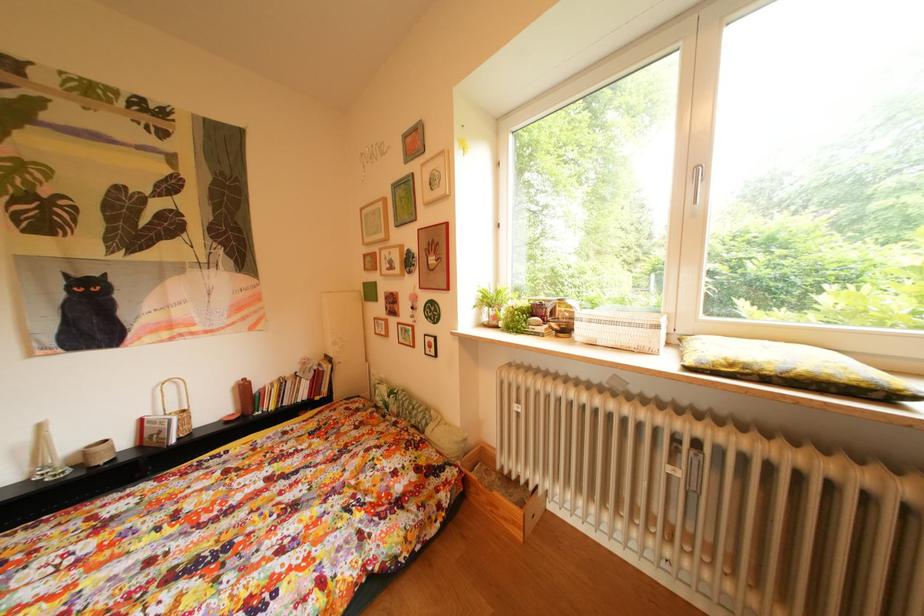
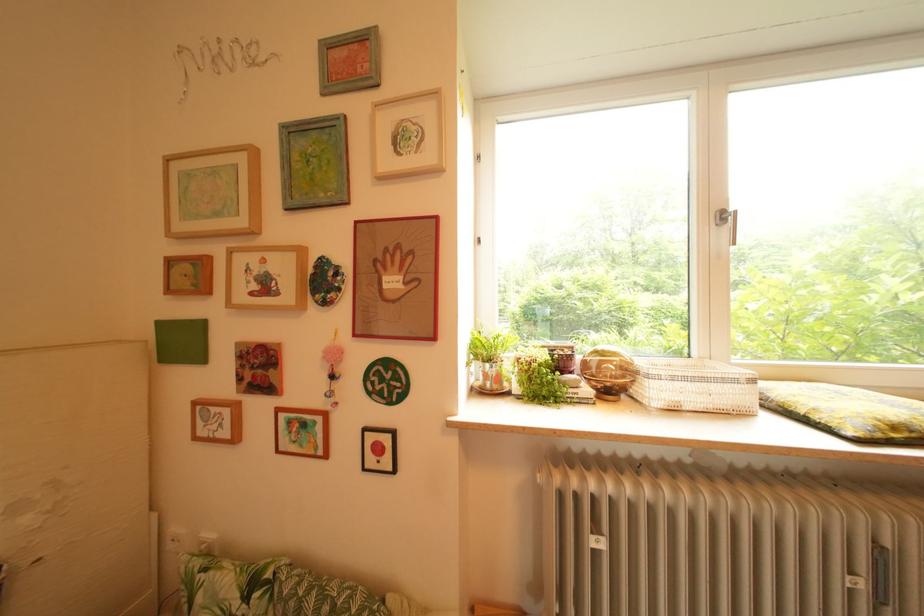
Question: The first image is from the beginning of the video and the second image is from the end. How did the camera likely rotate when shooting the video?

Choices:
 (A) Left
 (B) Right
 (C) Up
 (D) Down

Answer: (B)